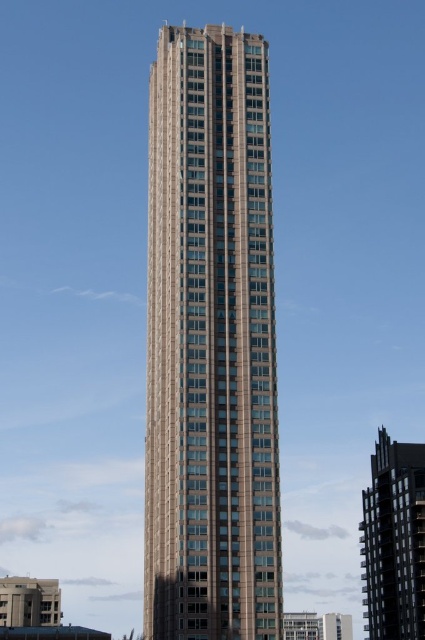
Question: Is brown stone building at center positioned before dark gray concrete building at lower right?

Choices:
 (A) yes
 (B) no

Answer: (A)

Question: In this image, where is brown stone building at center located relative to dark gray concrete building at lower right?

Choices:
 (A) below
 (B) above

Answer: (B)

Question: Which object appears farthest from the camera in this image?

Choices:
 (A) dark gray concrete building at lower right
 (B) brown stone building at center

Answer: (A)

Question: Which point is closer to the camera?

Choices:
 (A) (382, 600)
 (B) (175, 177)

Answer: (B)

Question: Where is brown stone building at center located in relation to dark gray concrete building at lower right in the image?

Choices:
 (A) left
 (B) right

Answer: (A)

Question: Which of the following is the farthest from the observer?

Choices:
 (A) (424, 452)
 (B) (195, 474)

Answer: (A)